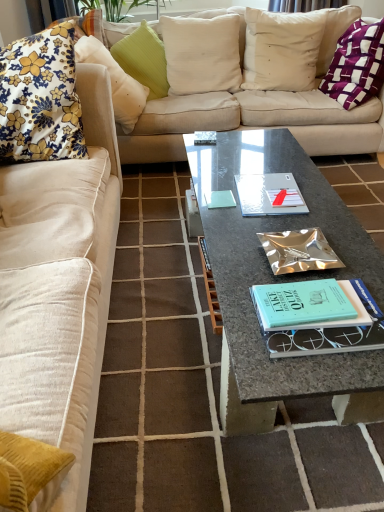
I want to click on vacant space underneath metallic silver book at center (from a real-world perspective), so click(x=298, y=257).